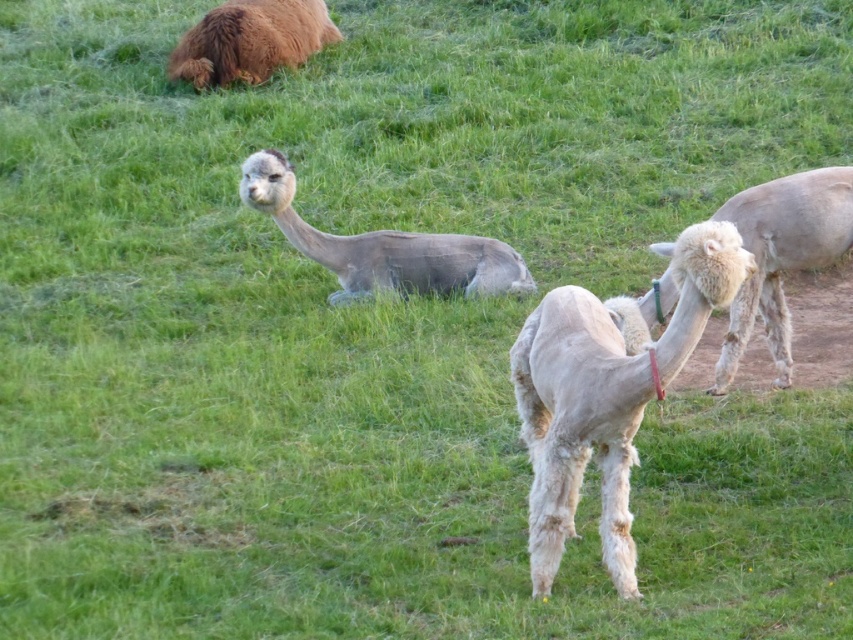
Is point (778, 276) closer to camera compared to point (287, 204)?

Yes, point (778, 276) is in front of point (287, 204).

Which is above, white woolen camel at right or fuzzy gray alpaca at center?

fuzzy gray alpaca at center is above.

Find the location of a particular element. This screenshot has height=640, width=853. white woolen camel at right is located at coordinates (781, 256).

Between white woolen camel at center and white woolen camel at right, which one has less height?

white woolen camel at right is shorter.

Is white woolen camel at center wider than white woolen camel at right?

Yes, white woolen camel at center is wider than white woolen camel at right.

Identify the location of white woolen camel at center. Image resolution: width=853 pixels, height=640 pixels. (605, 396).

I want to click on white woolen camel at center, so click(x=605, y=396).

Can you confirm if white woolen camel at center is taller than fuzzy gray alpaca at center?

Indeed, white woolen camel at center has a greater height compared to fuzzy gray alpaca at center.

Which is below, white woolen camel at center or fuzzy gray alpaca at center?

white woolen camel at center is below.

Describe the element at coordinates (605, 396) in the screenshot. I see `white woolen camel at center` at that location.

Find the location of `white woolen camel at center`. white woolen camel at center is located at coordinates (605, 396).